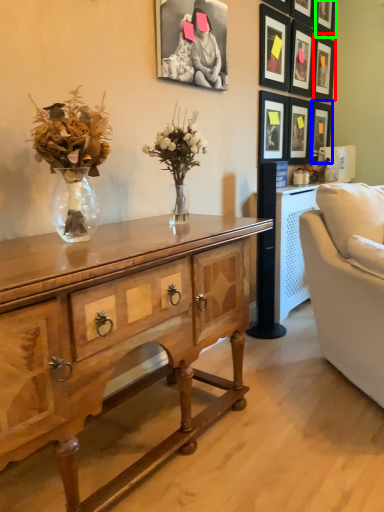
Question: Which object is the closest to the picture frame (highlighted by a red box)? Choose among these: picture frame (highlighted by a blue box) or picture frame (highlighted by a green box).

Choices:
 (A) picture frame
 (B) picture frame

Answer: (B)